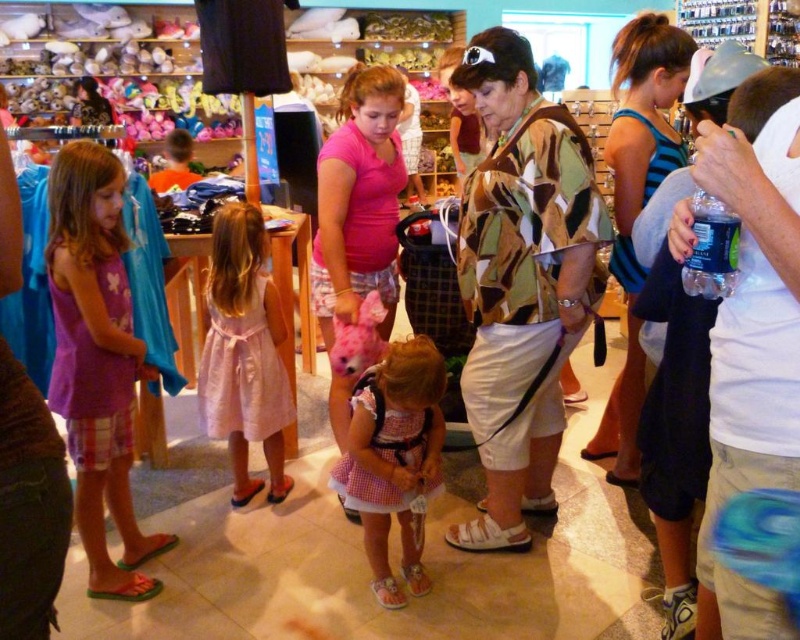
You are a store employee who needs to arrange these two items, the pink matte shirt at center and the pink gingham dress at center, closer together on the shelf so they are only 15 inches apart. Can you do this without moving any other items on the shelf?

The current distance between the pink matte shirt at center and the pink gingham dress at center is 20.56 inches. To reduce the gap to 15 inches, you would need to move them closer by 5.56 inches. However, since the question specifies not moving any other items, it depends on whether there is enough space available between them to adjust without disturbing adjacent items. Without additional information about the shelf layout, it is uncertain if this adjustment is feasible.